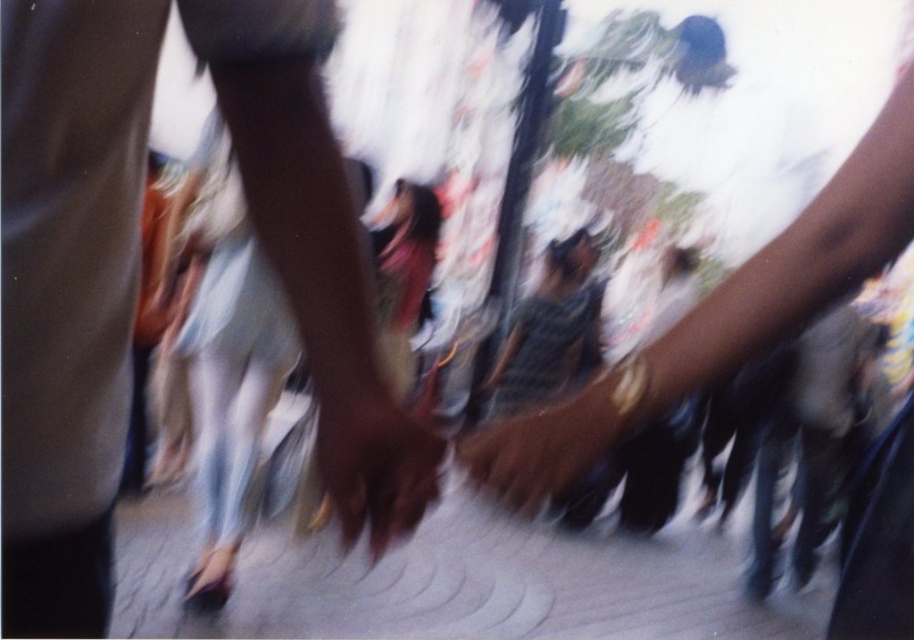
Question: Which point is farther to the camera?

Choices:
 (A) smooth brown hand at center
 (B) brown leather handbag at center
 (C) brown leather hand at center

Answer: (C)

Question: Which of the following is the farthest from the observer?

Choices:
 (A) smooth leather handbag at center
 (B) gray concrete pavement at center
 (C) smooth brown hand at center
 (D) brown leather handbag at center

Answer: (B)

Question: Observing the image, what is the correct spatial positioning of smooth leather handbag at center in reference to smooth brown hand at center?

Choices:
 (A) above
 (B) below

Answer: (B)

Question: Estimate the real-world distances between objects in this image. Which object is closer to the smooth leather handbag at center?

Choices:
 (A) brown leather handbag at center
 (B) gray concrete pavement at center

Answer: (A)

Question: Can you confirm if smooth leather handbag at center is positioned to the right of smooth brown hand at center?

Choices:
 (A) yes
 (B) no

Answer: (A)

Question: Can you confirm if smooth leather handbag at center is positioned above smooth brown hand at center?

Choices:
 (A) no
 (B) yes

Answer: (A)